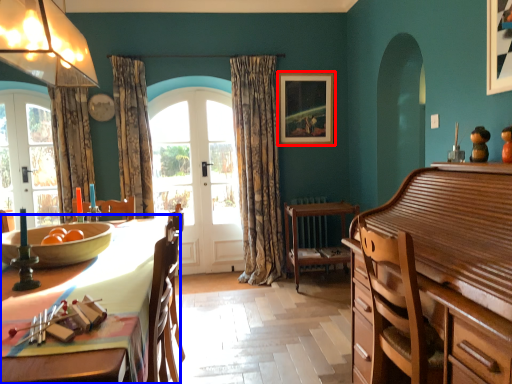
Question: Which of the following is the farthest to the observer, picture frame (highlighted by a red box) or table (highlighted by a blue box)?

Choices:
 (A) picture frame
 (B) table

Answer: (A)